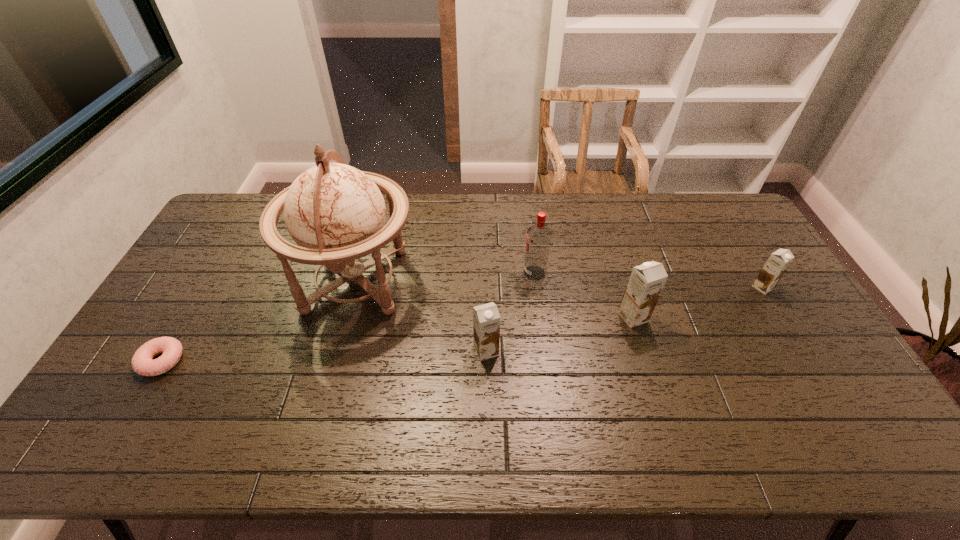
The image size is (960, 540). I want to click on vacant space that is in between the second chocolate milk from right to left and the fourth tallest object, so click(x=560, y=334).

Identify the location of free space that is in between the leftmost object and the leftmost chocolate milk. The height and width of the screenshot is (540, 960). (324, 355).

Identify the location of vacant space in between the tallest object and the vodka. (445, 276).

I want to click on free point between the fourth object from right to left and the doughnut, so click(324, 355).

I want to click on free space between the leftmost chocolate milk and the fourth object from left to right, so point(511,312).

The width and height of the screenshot is (960, 540). What are the coordinates of `vacant region between the doughnut and the second chocolate milk from right to left` in the screenshot? It's located at (397, 339).

You are a GUI agent. You are given a task and a screenshot of the screen. Output one action in this format:
    pyautogui.click(x=<x>, y=<y>)
    Task: Click on the unoccupied area between the second shortest chocolate milk and the fourth object from left to right
    The width and height of the screenshot is (960, 540).
    Given the screenshot: What is the action you would take?
    pyautogui.click(x=511, y=312)

Where is `vacant space that is in between the fourth object from left to right and the globe`? vacant space that is in between the fourth object from left to right and the globe is located at coordinates (445, 276).

Where is `object that is the fifth nearest to the fifth object from left to right`? This screenshot has width=960, height=540. object that is the fifth nearest to the fifth object from left to right is located at coordinates (142, 363).

This screenshot has width=960, height=540. Find the location of `the closest object to the vodka`. the closest object to the vodka is located at coordinates (646, 282).